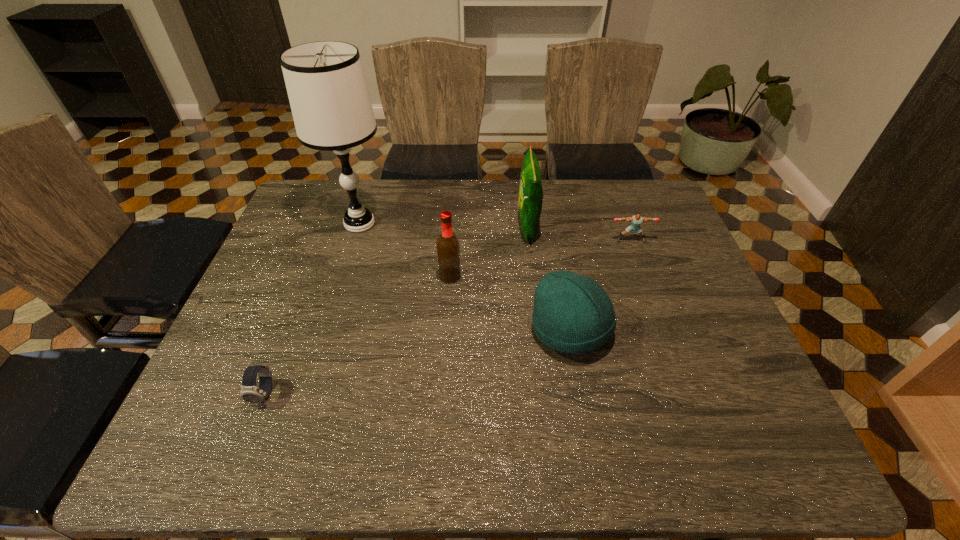
Locate an element on the screen. the tallest object is located at coordinates (328, 94).

The image size is (960, 540). Identify the location of crisp (potato chip). (530, 187).

This screenshot has height=540, width=960. What are the coordinates of `the third object from left to right` in the screenshot? It's located at pyautogui.click(x=448, y=249).

You are a GUI agent. You are given a task and a screenshot of the screen. Output one action in this format:
    pyautogui.click(x=<x>, y=<y>)
    Task: Click on the beer bottle
    Image resolution: width=960 pixels, height=540 pixels.
    Given the screenshot: What is the action you would take?
    point(448,249)

You are a GUI agent. You are given a task and a screenshot of the screen. Output one action in this format:
    pyautogui.click(x=<x>, y=<y>)
    Task: Click on the fifth farthest object
    This screenshot has width=960, height=540.
    Given the screenshot: What is the action you would take?
    pyautogui.click(x=573, y=314)

Identify the location of the third shortest object. The height and width of the screenshot is (540, 960). (573, 314).

Locate an element on the screen. the rightmost object is located at coordinates (636, 220).

Where is `watch`? watch is located at coordinates (250, 392).

The image size is (960, 540). In order to click on the shortest object in this screenshot , I will do `click(250, 392)`.

Identify the location of vacant region located on the left of the tallest object. (288, 224).